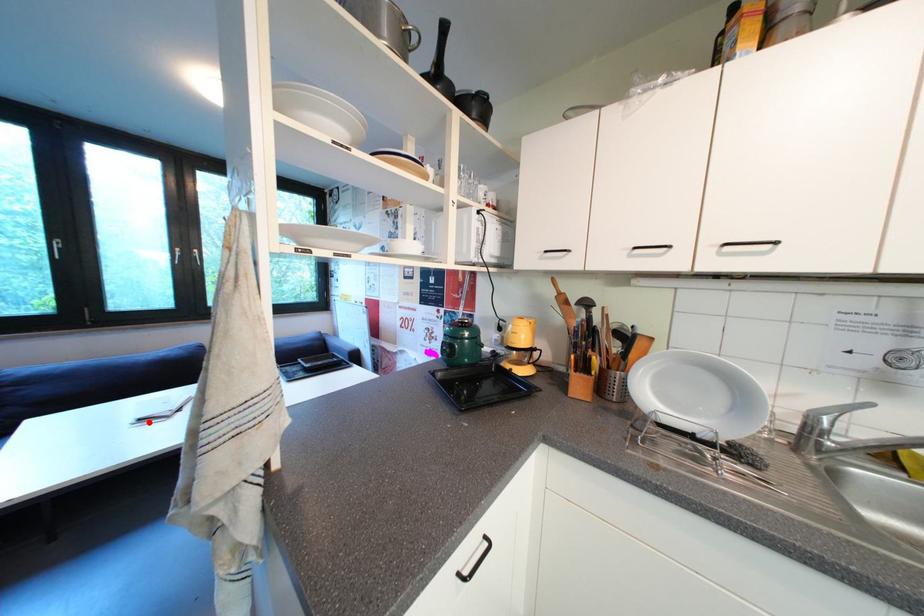
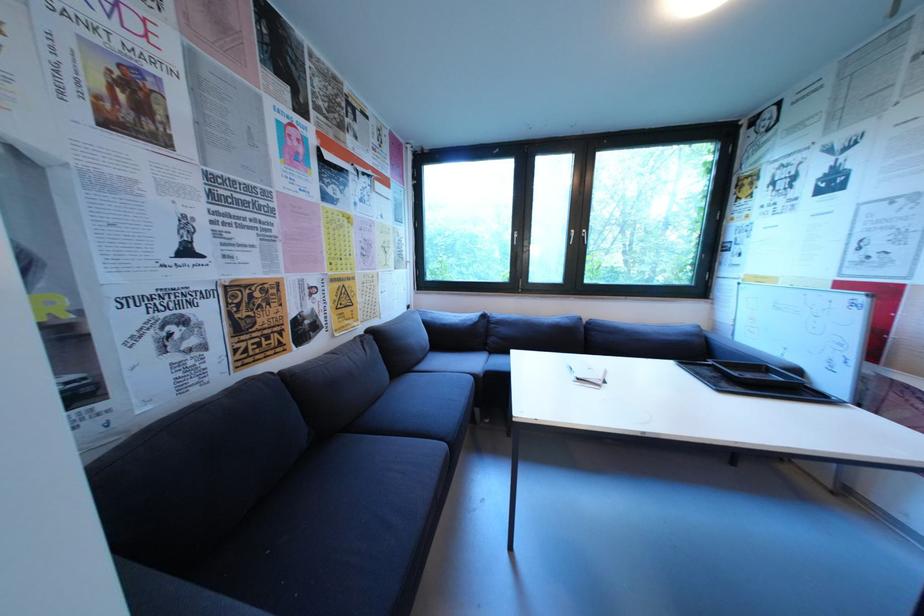
Locate, in the second image, the point that corresponds to the highlighted location in the first image.

(586, 381)